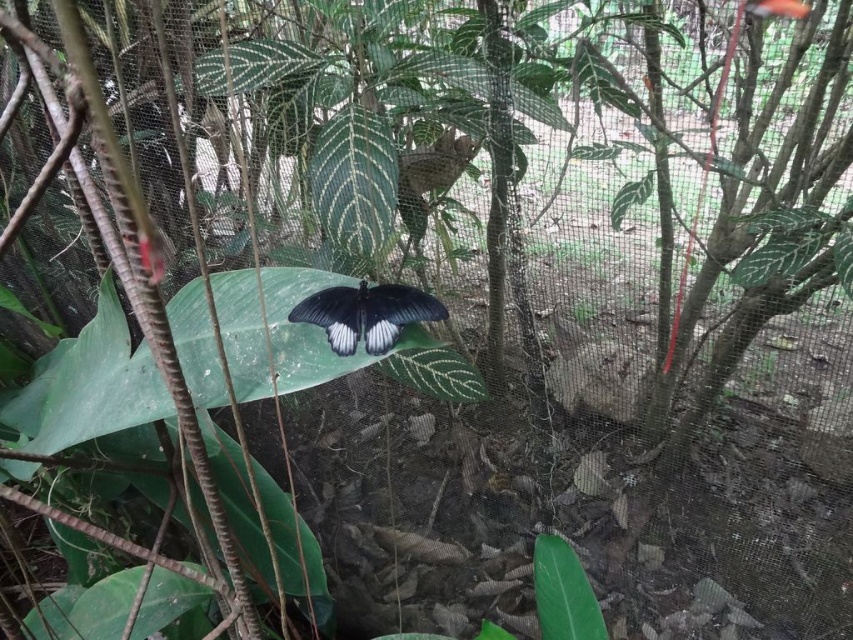
You are a small insect that needs to reach the green matte leaf at center from the green matte leaf at lower center. Which leaf should you climb towards, and why?

You should climb towards the green matte leaf at center because it is smaller in size compared to the green matte leaf at lower center, making it easier to navigate for a small insect.

You are a small insect that needs to cross from the green textured leaf at center to the green textured leaf at upper right. Which leaf should you choose as your starting point if you want to travel a shorter distance horizontally?

The green textured leaf at center has a smaller width than the green textured leaf at upper right, so starting from the green textured leaf at center would allow the insect to travel a shorter horizontal distance.

You are a gardener observing a garden enclosed in a netted structure. You notice a black glossy butterfly at center and a green glossy leaf at center. Which object is positioned more to the left in the scene?

The black glossy butterfly at center is positioned more to the left than the green glossy leaf at center according to the scene description.